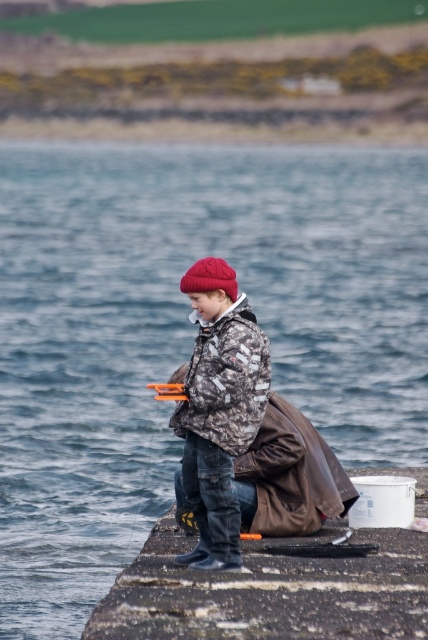
How far apart are camouflage jacket at center and red woolen hat at center?

4.78 feet

Where is `camouflage jacket at center`? The image size is (428, 640). camouflage jacket at center is located at coordinates (219, 408).

Which is in front, point (214, 308) or point (196, 276)?

Point (196, 276) is in front.

Locate an element on the screen. The width and height of the screenshot is (428, 640). camouflage jacket at center is located at coordinates (219, 408).